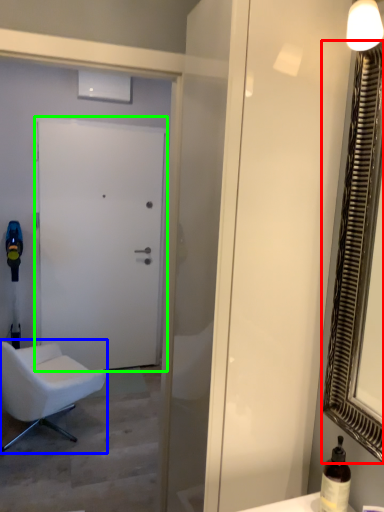
Question: Which object is positioned farthest from mirror (highlighted by a red box)? Select from chair (highlighted by a blue box) and door (highlighted by a green box).

Choices:
 (A) chair
 (B) door

Answer: (B)